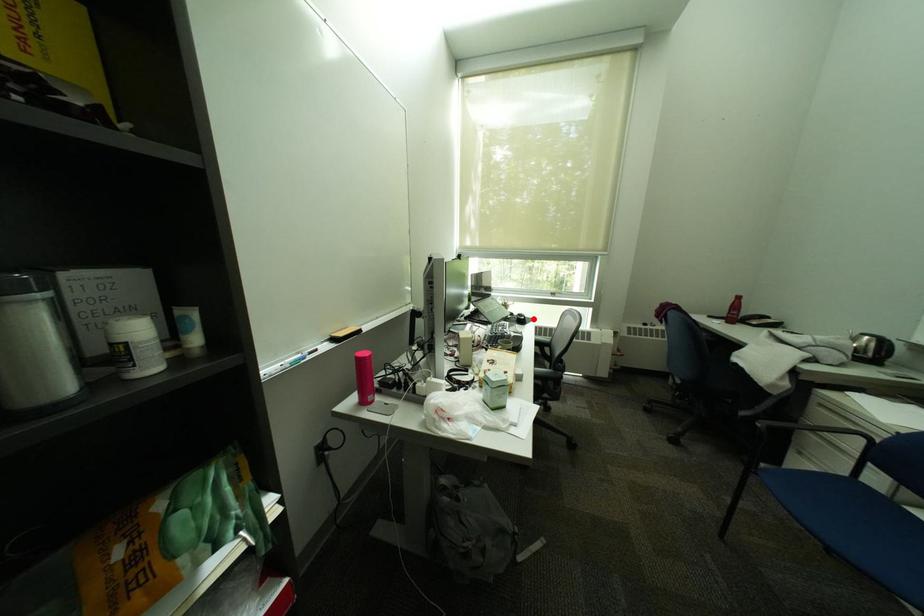
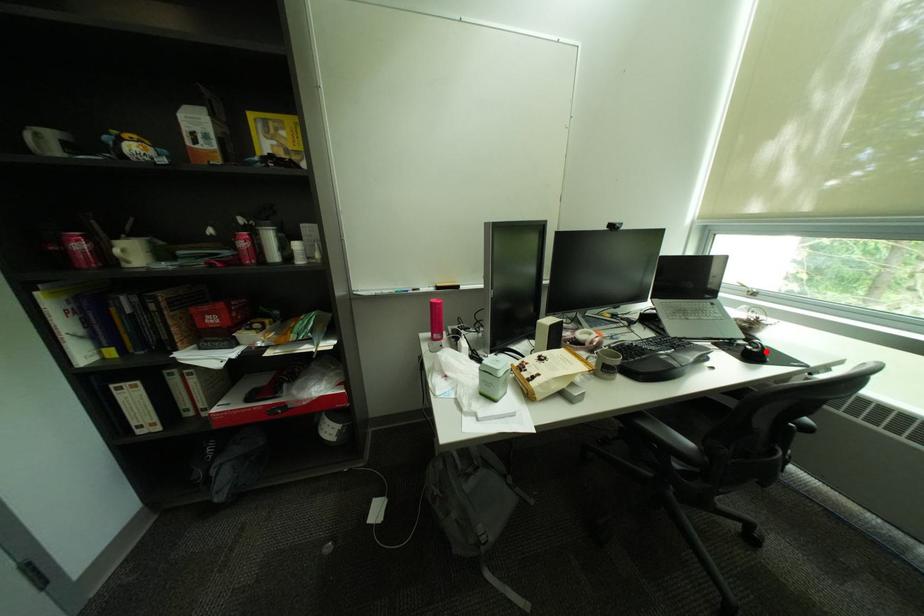
I am providing you with two images of the same scene from different viewpoints. A red point is marked on the first image and another point is marked on the second image. Do the highlighted points in image1 and image2 indicate the same real-world spot?

Yes